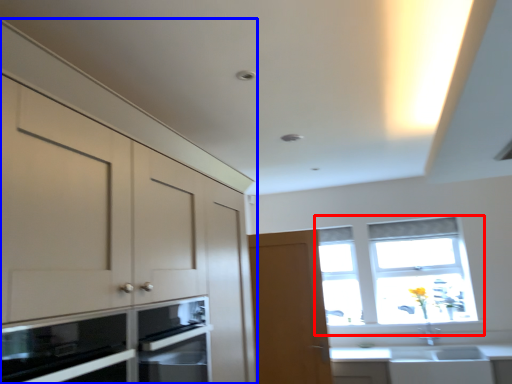
Question: Which object is further to the camera taking this photo, window (highlighted by a red box) or cabinetry (highlighted by a blue box)?

Choices:
 (A) window
 (B) cabinetry

Answer: (A)